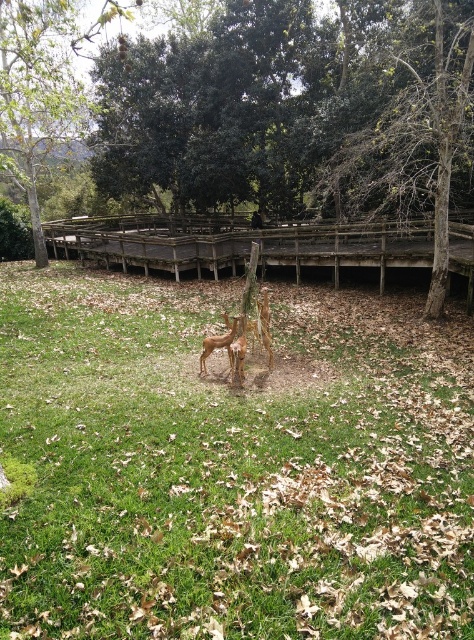
Is point (154, 531) positioned behind point (404, 193)?

No, it is not.

Identify the location of green grass at center. (231, 465).

Consider the image. Does dark green textured tree at upper center appear on the left side of green leafy tree at upper center?

No, dark green textured tree at upper center is not to the left of green leafy tree at upper center.

Is point (461, 99) positioned after point (7, 88)?

No.

I want to click on dark green textured tree at upper center, so pyautogui.click(x=422, y=124).

Where is `dark green textured tree at upper center`? The width and height of the screenshot is (474, 640). dark green textured tree at upper center is located at coordinates (422, 124).

Does green grass at center appear on the left side of green leafy tree at upper center?

No, green grass at center is not to the left of green leafy tree at upper center.

Which is in front, point (100, 476) or point (100, 8)?

Point (100, 476) is in front.

You are a GUI agent. You are given a task and a screenshot of the screen. Output one action in this format:
    pyautogui.click(x=<x>, y=<y>)
    Task: Click on the green grass at center
    The image size is (474, 640).
    Given the screenshot: What is the action you would take?
    pyautogui.click(x=231, y=465)

The image size is (474, 640). What are the coordinates of `green grass at center` in the screenshot? It's located at (231, 465).